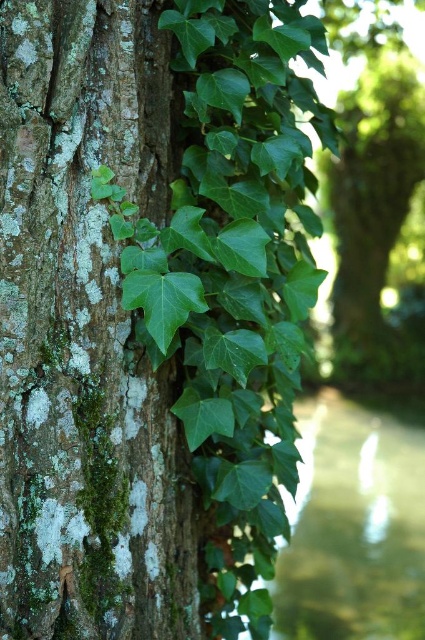
Is green leafy creeks at lower right to the right of green leafy ivy at center from the viewer's perspective?

In fact, green leafy creeks at lower right is to the left of green leafy ivy at center.

The image size is (425, 640). Identify the location of green leafy creeks at lower right. (354, 528).

Who is positioned more to the right, green mossy bark at left or green leafy ivy at center?

From the viewer's perspective, green leafy ivy at center appears more on the right side.

Between point (5, 355) and point (376, 257), which one is positioned in front?

Point (5, 355) is in front.

Identify the location of green mossy bark at left. (85, 336).

Is green mossy bark at left bigger than green leafy creeks at lower right?

No.

Between point (147, 42) and point (357, 536), which one is positioned behind?

Positioned behind is point (357, 536).

Where is `green mossy bark at left`? green mossy bark at left is located at coordinates [85, 336].

This screenshot has width=425, height=640. Identify the location of green mossy bark at left. (85, 336).